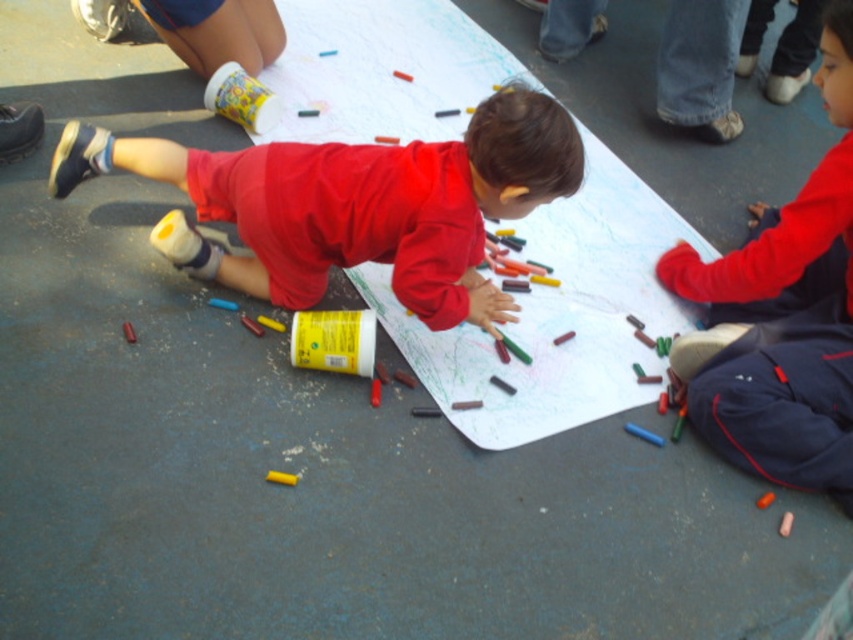
You are a photographer standing at the origin point looking towards the positive direction of the coordinate system. You want to take a photo of both the point at (376, 156) and the point at (677, 340). Which point should you focus on first to ensure both are in frame?

You should focus on the point at (376, 156) first because it is in front of the point at (677, 340), so capturing it first ensures both are within the frame.

You are a photographer trying to capture the scene of the children drawing. You want to ensure both the matte red shirt at center and the matte red shirt at lower right are clearly visible in your shot. Which child should you focus on to capture the wider one?

The matte red shirt at center is wider than the matte red shirt at lower right, so focusing on the matte red shirt at center will capture the wider one.